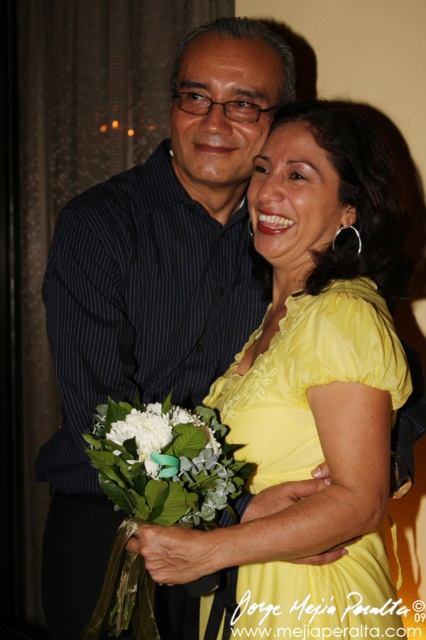
Question: Which of these objects is positioned closest to the white matte flower at center?

Choices:
 (A) yellow satin dress at center
 (B) white fabric bouquet at center

Answer: (B)

Question: Can you confirm if yellow satin dress at center is positioned below white matte flower at center?

Choices:
 (A) no
 (B) yes

Answer: (B)

Question: Based on their relative distances, which object is farther from the white matte flower at center?

Choices:
 (A) white fabric bouquet at center
 (B) yellow satin dress at center

Answer: (B)

Question: Does yellow satin dress at center come in front of white fabric bouquet at center?

Choices:
 (A) no
 (B) yes

Answer: (A)

Question: Can you confirm if white fabric bouquet at center is positioned below white matte flower at center?

Choices:
 (A) yes
 (B) no

Answer: (A)

Question: Which object appears closest to the camera in this image?

Choices:
 (A) yellow satin dress at center
 (B) white matte flower at center

Answer: (A)